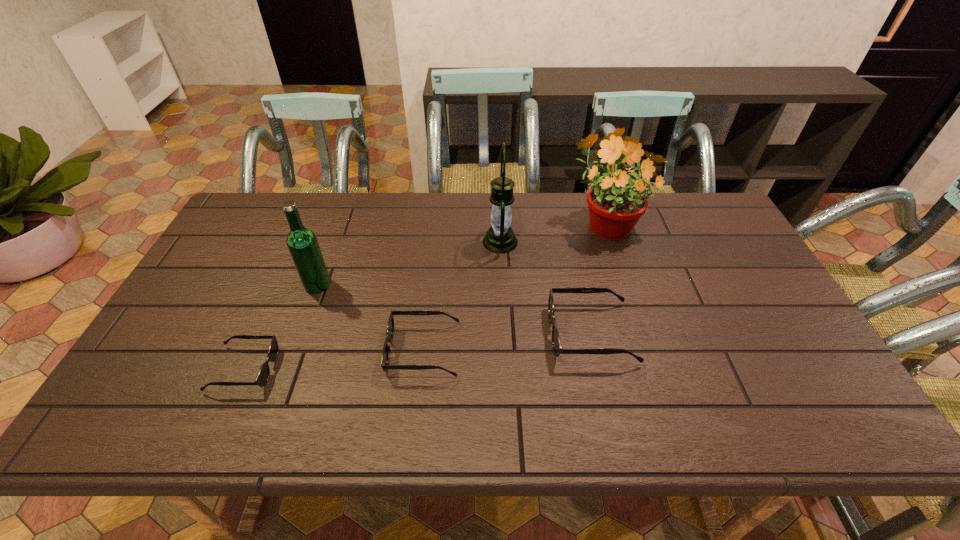
Identify the location of vacant space located at the front lenses of the shortest object. The height and width of the screenshot is (540, 960). (414, 369).

I want to click on free region located 0.180m at the front lenses of the second sunglasses from right to left, so click(316, 350).

The width and height of the screenshot is (960, 540). I want to click on free region located at the front lenses of the second sunglasses from right to left, so click(352, 350).

This screenshot has height=540, width=960. I want to click on free point located at the front lenses of the second sunglasses from right to left, so click(x=256, y=350).

Identify the location of free space located 0.260m at the front lenses of the rightmost sunglasses. (449, 333).

Where is `free space located at the front lenses of the rightmost sunglasses`? free space located at the front lenses of the rightmost sunglasses is located at coordinates (496, 333).

Locate an element on the screen. vacant space situated at the front lenses of the rightmost sunglasses is located at coordinates (523, 333).

This screenshot has height=540, width=960. In order to click on vacant space located 0.160m on the left of the flowerpot in this screenshot , I will do `click(516, 222)`.

Find the location of `vacant space located on the side where the lantern emits light`. vacant space located on the side where the lantern emits light is located at coordinates pos(369,242).

Image resolution: width=960 pixels, height=540 pixels. Find the location of `vacant space located on the side where the lantern emits light`. vacant space located on the side where the lantern emits light is located at coordinates (442, 242).